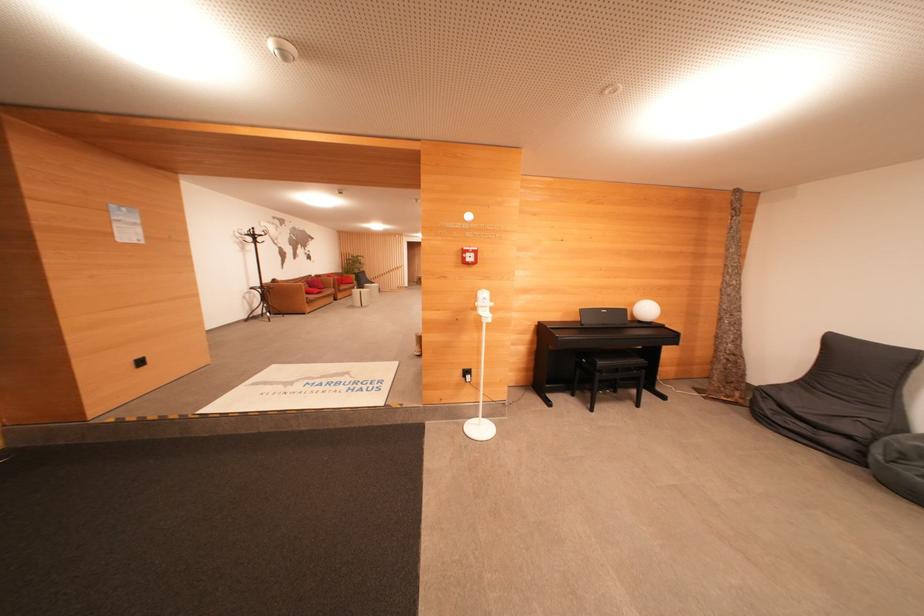
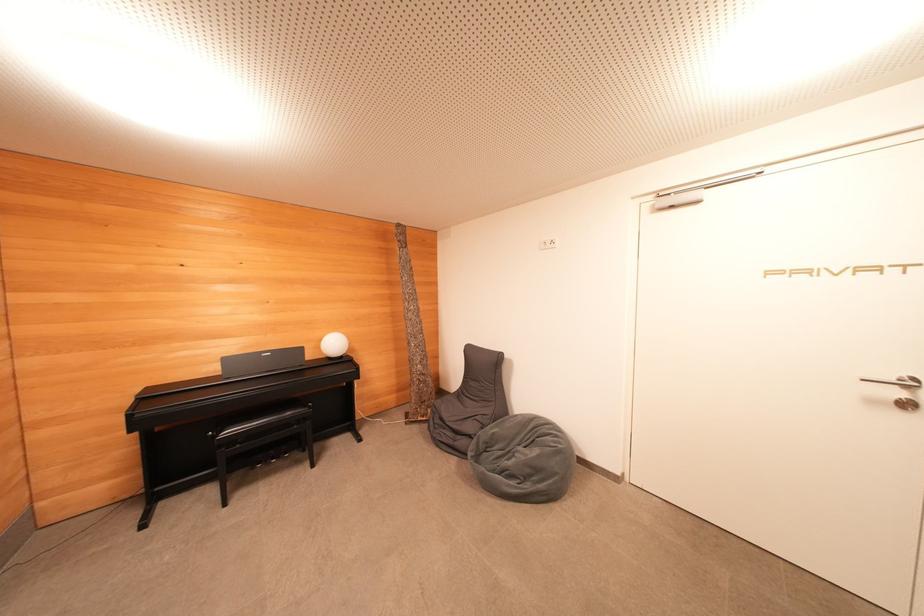
The point at (650, 314) is marked in the first image. Where is the corresponding point in the second image?

(337, 347)